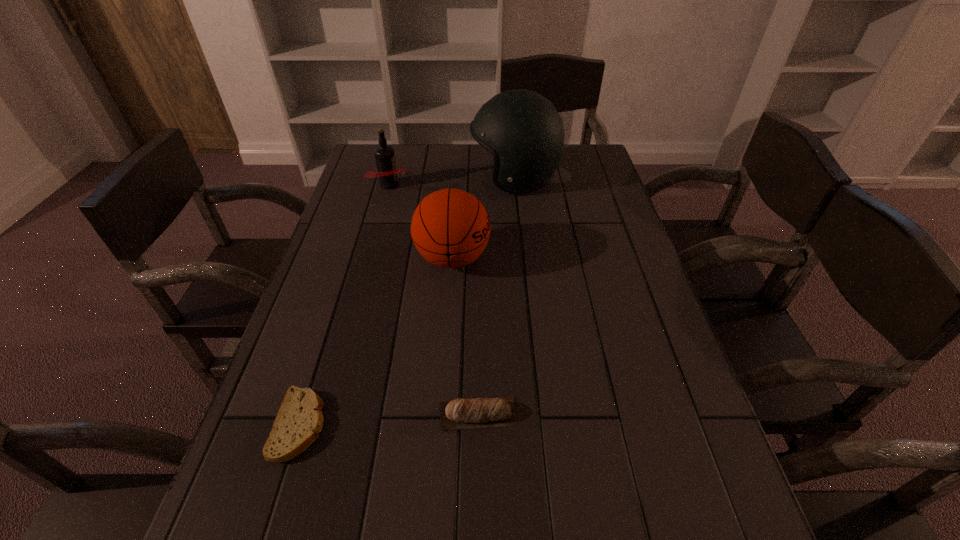
You are a GUI agent. You are given a task and a screenshot of the screen. Output one action in this format:
    pyautogui.click(x=<x>, y=<y>)
    Task: Click on the unoccupied position between the taller pita bread and the basketball
    Image resolution: width=960 pixels, height=540 pixels.
    Given the screenshot: What is the action you would take?
    pyautogui.click(x=466, y=336)

At what (x,y) coordinates should I click in order to perform the action: click on empty space that is in between the third nearest object and the right pita bread. Please return your answer as a coordinate pair (x, y). This screenshot has height=540, width=960. Looking at the image, I should click on (466, 336).

Identify the location of vacant region between the taller pita bread and the basketball. This screenshot has height=540, width=960. (466, 336).

The width and height of the screenshot is (960, 540). I want to click on empty location between the football helmet and the shorter pita bread, so click(x=407, y=301).

Where is `free space between the root beer and the second shortest object`? free space between the root beer and the second shortest object is located at coordinates (434, 299).

Point out which object is positioned as the second nearest to the tallest object. Please provide its 2D coordinates. Your answer should be formatted as a tuple, i.e. [(x, y)], where the tuple contains the x and y coordinates of a point satisfying the conditions above.

[(387, 172)]

Identify which object is the third nearest to the right pita bread. Please provide its 2D coordinates. Your answer should be formatted as a tuple, i.e. [(x, y)], where the tuple contains the x and y coordinates of a point satisfying the conditions above.

[(522, 129)]

Where is `vacant space that satisfies the following two spatial constraints: 1. on the label of the root beer; 2. on the left side of the fourth tallest object`? The height and width of the screenshot is (540, 960). vacant space that satisfies the following two spatial constraints: 1. on the label of the root beer; 2. on the left side of the fourth tallest object is located at coordinates (328, 414).

Where is `vacant space that satisfies the following two spatial constraints: 1. on the back side of the second shortest object; 2. on the side with logo of the third nearest object`? The height and width of the screenshot is (540, 960). vacant space that satisfies the following two spatial constraints: 1. on the back side of the second shortest object; 2. on the side with logo of the third nearest object is located at coordinates (479, 259).